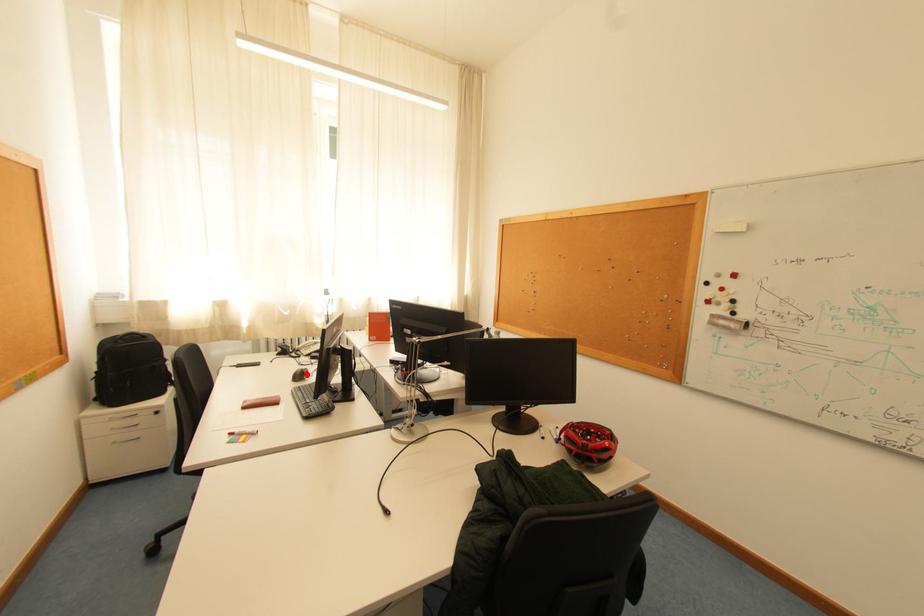
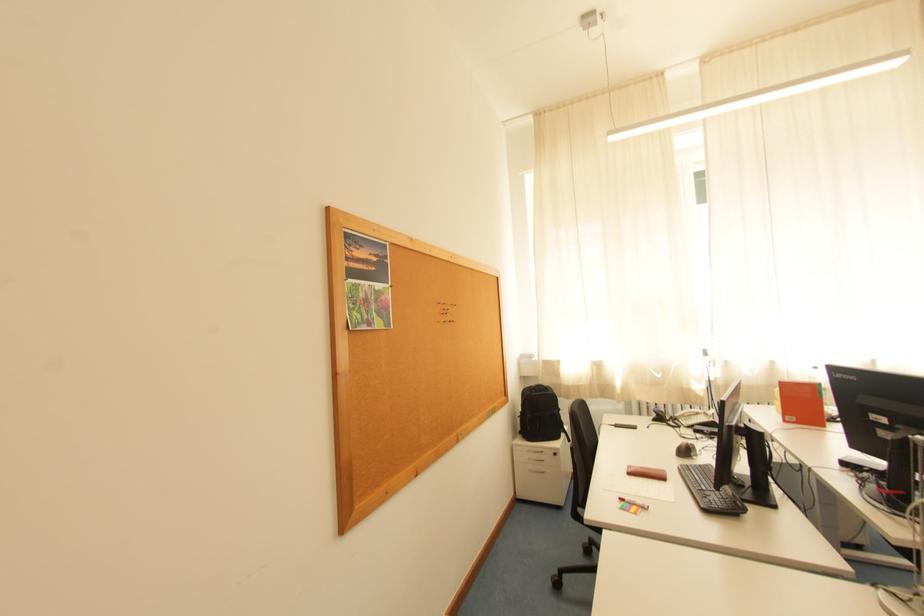
Question: I am providing you with two images of the same scene from different viewpoints. Image1 has a red point marked. In image2, the corresponding 3D location appears at what relative position? Reply with the corresponding letter.

Choices:
 (A) Closer
 (B) Farther

Answer: (A)